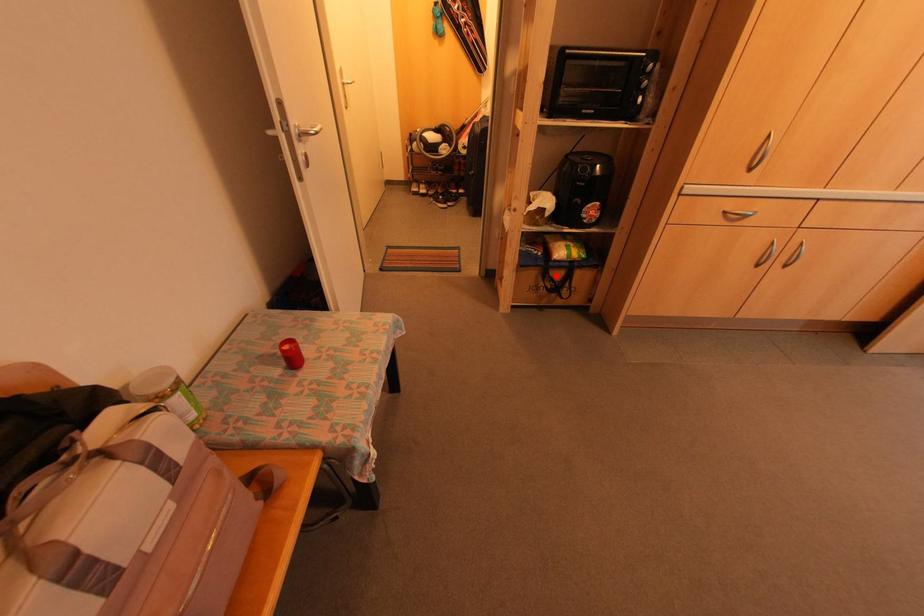
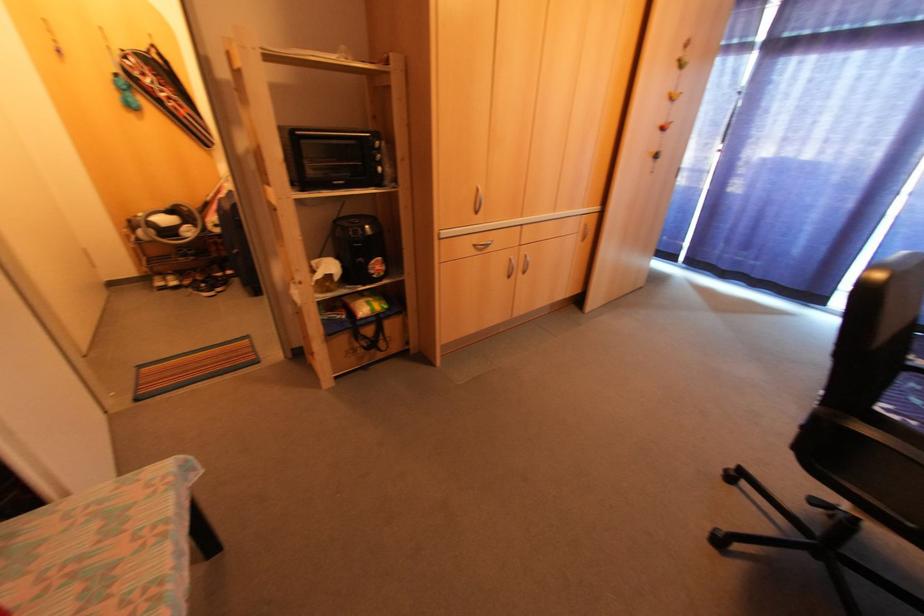
Where in the second image is the point corresponding to the highlighted location from the first image?

(367, 331)